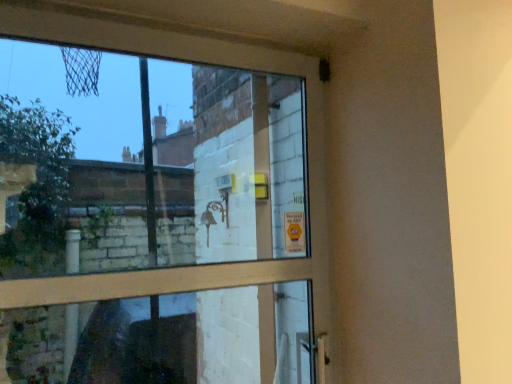
Where is `transparent glass window at upper center`? This screenshot has width=512, height=384. transparent glass window at upper center is located at coordinates (151, 222).

This screenshot has width=512, height=384. Describe the element at coordinates (151, 222) in the screenshot. I see `transparent glass window at upper center` at that location.

You are a GUI agent. You are given a task and a screenshot of the screen. Output one action in this format:
    pyautogui.click(x=<x>, y=<y>)
    Task: Click on the transparent glass window at upper center
    
    Given the screenshot: What is the action you would take?
    pyautogui.click(x=151, y=222)